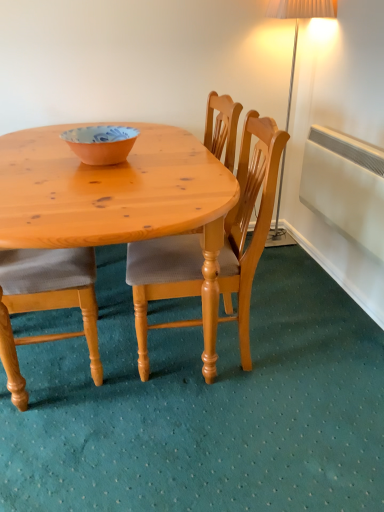
Identify the location of empty space that is ontop of white plastic radiator at right. The width and height of the screenshot is (384, 512). (360, 137).